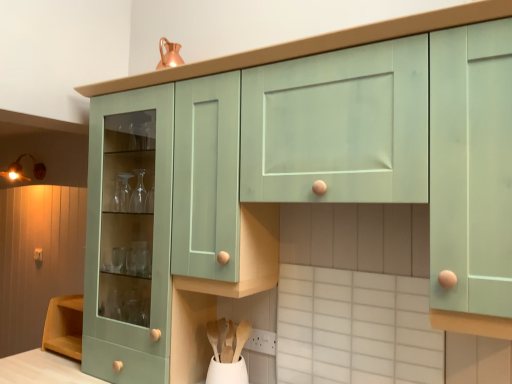
What do you see at coordinates (241, 338) in the screenshot? The width and height of the screenshot is (512, 384). I see `wooden at lower center, positioned as the second spoon in left-to-right order` at bounding box center [241, 338].

You are a GUI agent. You are given a task and a screenshot of the screen. Output one action in this format:
    pyautogui.click(x=<x>, y=<y>)
    Task: Click on the white plastic power plugs and sockets at lower center
    
    Given the screenshot: What is the action you would take?
    pyautogui.click(x=261, y=342)

At what (x,y) coordinates should I click in order to perform the action: click on wooden at lower center, which is the second spoon in right-to-left order. Please return your answer as a coordinate pair (x, y). Looking at the image, I should click on point(213,337).

What do you see at coordinates (227, 372) in the screenshot?
I see `white matte vase at lower center` at bounding box center [227, 372].

You are a GUI agent. You are given a task and a screenshot of the screen. Output one action in this format:
    pyautogui.click(x=<x>, y=<y>)
    Task: Click on the matte gold light fixture at upper left
    This screenshot has height=384, width=512.
    Given the screenshot: What is the action you would take?
    pyautogui.click(x=21, y=170)

Is white matte vase at lower center facing away from matte gold light fixture at upper left?

white matte vase at lower center is not turned away from matte gold light fixture at upper left.

Is white matte vase at lower center surrounding matte gold light fixture at upper left?

That's incorrect, matte gold light fixture at upper left is not inside white matte vase at lower center.

Can you tell me how much white matte vase at lower center and matte gold light fixture at upper left differ in facing direction?

There is a 4.51-degree angle between the facing directions of white matte vase at lower center and matte gold light fixture at upper left.

Is white matte vase at lower center bigger than matte gold light fixture at upper left?

Incorrect, white matte vase at lower center is not larger than matte gold light fixture at upper left.

Who is smaller, wooden at lower center, positioned as the second spoon in left-to-right order, or mint green cabinet at center?

With smaller size is wooden at lower center, positioned as the second spoon in left-to-right order.

Which object is positioned more to the left, wooden at lower center, positioned as the second spoon in left-to-right order, or mint green cabinet at center?

From the viewer's perspective, mint green cabinet at center appears more on the left side.

Is wooden at lower center, positioned as the second spoon in left-to-right order, facing away from mint green cabinet at center?

That's not correct — wooden at lower center, positioned as the second spoon in left-to-right order, is not looking away from mint green cabinet at center.

Does point (243, 327) come in front of point (112, 116)?

That is True.

Between white matte vase at lower center and mint green cabinet at center, which one appears on the left side from the viewer's perspective?

mint green cabinet at center.

Could you tell me if white matte vase at lower center is facing mint green cabinet at center?

No, white matte vase at lower center does not turn towards mint green cabinet at center.

Is white matte vase at lower center further to camera compared to mint green cabinet at center?

No, white matte vase at lower center is closer to the camera.

Considering the sizes of white matte vase at lower center and mint green cabinet at center in the image, is white matte vase at lower center bigger or smaller than mint green cabinet at center?

Clearly, white matte vase at lower center is smaller in size than mint green cabinet at center.

This screenshot has height=384, width=512. Find the location of `spoon that is the 1st object directly below the mint green cabinet at center (from a real-world perspective)`. spoon that is the 1st object directly below the mint green cabinet at center (from a real-world perspective) is located at coordinates (213, 337).

Is point (219, 361) behind point (125, 277)?

No, (219, 361) is in front of (125, 277).

Could mint green cabinet at center be considered to be inside wooden at lower center, which is the second spoon in right-to-left order?

Actually, mint green cabinet at center is outside wooden at lower center, which is the second spoon in right-to-left order.

From a real-world perspective, which object stands above the other?

mint green cabinet at center is physically above.

Identify the location of light fixture behind the wooden at lower center, positioned as the second spoon in left-to-right order. (21, 170).

From a real-world perspective, does matte gold light fixture at upper left stand above wooden at lower center, which is the 1th spoon from right to left?

Yes, from a real-world perspective, matte gold light fixture at upper left is above wooden at lower center, which is the 1th spoon from right to left.

From the image's perspective, does matte gold light fixture at upper left appear higher than wooden at lower center, which is the 1th spoon from right to left?

Yes, from the image's perspective, matte gold light fixture at upper left is over wooden at lower center, which is the 1th spoon from right to left.

Is matte gold light fixture at upper left bigger or smaller than wooden at lower center, positioned as the second spoon in left-to-right order?

In the image, matte gold light fixture at upper left appears to be larger than wooden at lower center, positioned as the second spoon in left-to-right order.

Is matte gold light fixture at upper left facing away from matte wooden knob at lower left?

No.

From the image's perspective, between matte gold light fixture at upper left and matte wooden knob at lower left, which one is located above?

From the image's view, matte gold light fixture at upper left is above.

Is matte gold light fixture at upper left in front of or behind matte wooden knob at lower left in the image?

matte gold light fixture at upper left is in front of matte wooden knob at lower left.

From the image's perspective, who appears lower, wooden at lower center, positioned as the second spoon in left-to-right order, or matte wooden knob at lower left?

From the image's view, wooden at lower center, positioned as the second spoon in left-to-right order, is below.

Considering the positions of objects wooden at lower center, positioned as the second spoon in left-to-right order, and matte wooden knob at lower left in the image provided, who is in front, wooden at lower center, positioned as the second spoon in left-to-right order, or matte wooden knob at lower left?

wooden at lower center, positioned as the second spoon in left-to-right order, is more forward.

Does wooden at lower center, positioned as the second spoon in left-to-right order, have a greater height compared to matte wooden knob at lower left?

Yes, wooden at lower center, positioned as the second spoon in left-to-right order, is taller than matte wooden knob at lower left.

Image resolution: width=512 pixels, height=384 pixels. In order to click on vase that appears on the right of matte gold light fixture at upper left in this screenshot , I will do `click(227, 372)`.

Where is `spoon that is the 2nd one when counting downward from the mint green cabinet at center (from the image's perspective)`? The width and height of the screenshot is (512, 384). spoon that is the 2nd one when counting downward from the mint green cabinet at center (from the image's perspective) is located at coordinates (241, 338).

Considering their positions, is white plastic power plugs and sockets at lower center positioned closer to matte gold light fixture at upper left than white matte vase at lower center?

Based on the image, white matte vase at lower center appears to be nearer to matte gold light fixture at upper left.

Looking at the image, which one is located further to white matte vase at lower center, matte gold light fixture at upper left or wooden at lower center, which is the second spoon in right-to-left order?

Among the two, matte gold light fixture at upper left is located further to white matte vase at lower center.

When comparing their distances from wooden at lower center, which is the second spoon in right-to-left order, does matte gold light fixture at upper left or wooden at lower center, which is the 1th spoon from right to left, seem further?

matte gold light fixture at upper left lies further to wooden at lower center, which is the second spoon in right-to-left order, than the other object.

Consider the image. Estimate the real-world distances between objects in this image. Which object is closer to wooden at lower center, the first spoon when ordered from left to right, white matte vase at lower center or white plastic power plugs and sockets at lower center?

white matte vase at lower center.

From the image, which object appears to be farther from wooden at lower center, which is the 1th spoon from right to left, wooden at lower center, the first spoon when ordered from left to right, or mint green cabinet at center?

Based on the image, mint green cabinet at center appears to be further to wooden at lower center, which is the 1th spoon from right to left.

From the image, which object appears to be nearer to wooden at lower center, which is the second spoon in right-to-left order, white plastic power plugs and sockets at lower center or matte wooden knob at lower left?

white plastic power plugs and sockets at lower center lies closer to wooden at lower center, which is the second spoon in right-to-left order, than the other object.

From the image, which object appears to be farther from white plastic power plugs and sockets at lower center, wooden at lower center, which is the 1th spoon from right to left, or wooden at lower center, which is the second spoon in right-to-left order?

The object further to white plastic power plugs and sockets at lower center is wooden at lower center, which is the second spoon in right-to-left order.

When comparing their distances from matte wooden knob at lower left, does wooden at lower center, positioned as the second spoon in left-to-right order, or matte gold light fixture at upper left seem closer?

matte gold light fixture at upper left is closer to matte wooden knob at lower left.

Find the location of a particular element. light fixture between mint green cabinet at center and matte wooden knob at lower left in the front-back direction is located at coordinates (21, 170).

Where is `knob located between matte gold light fixture at upper left and wooden at lower center, which is the second spoon in right-to-left order, in the left-right direction`? Image resolution: width=512 pixels, height=384 pixels. knob located between matte gold light fixture at upper left and wooden at lower center, which is the second spoon in right-to-left order, in the left-right direction is located at coordinates (38, 255).

I want to click on spoon between matte gold light fixture at upper left and wooden at lower center, which is the 1th spoon from right to left, in the horizontal direction, so click(x=213, y=337).

Image resolution: width=512 pixels, height=384 pixels. Identify the location of vase situated between matte gold light fixture at upper left and white plastic power plugs and sockets at lower center from left to right. (227, 372).